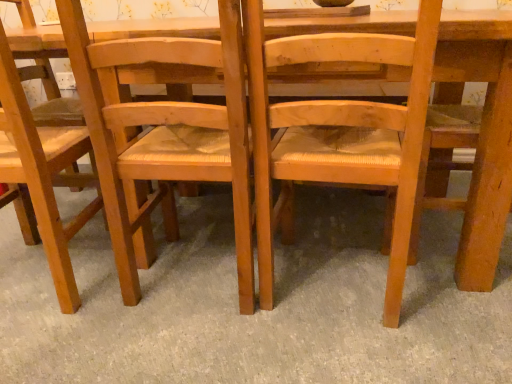
Question: Does natural wood chair at center, the third chair viewed from the left, touch light brown wood chair at left, which ranks as the 1th chair in left-to-right order?

Choices:
 (A) no
 (B) yes

Answer: (A)

Question: Can we say natural wood chair at center, the third chair viewed from the left, lies outside light brown wood chair at left, arranged as the 3th chair when viewed from the right?

Choices:
 (A) yes
 (B) no

Answer: (A)

Question: From the image's perspective, is natural wood chair at center, the third chair viewed from the left, located beneath light brown wood chair at left, arranged as the 3th chair when viewed from the right?

Choices:
 (A) no
 (B) yes

Answer: (B)

Question: Is natural wood chair at center, the third chair viewed from the left, taller than light brown wood chair at left, which ranks as the 1th chair in left-to-right order?

Choices:
 (A) yes
 (B) no

Answer: (B)

Question: Considering the relative positions of natural wood chair at center, which ranks as the first chair in right-to-left order, and light brown wood chair at left, which ranks as the 1th chair in left-to-right order, in the image provided, is natural wood chair at center, which ranks as the first chair in right-to-left order, to the right of light brown wood chair at left, which ranks as the 1th chair in left-to-right order, from the viewer's perspective?

Choices:
 (A) yes
 (B) no

Answer: (A)

Question: In terms of width, does light brown wood chair at left, arranged as the 3th chair when viewed from the right, look wider or thinner when compared to natural wood chair at center, which ranks as the first chair in right-to-left order?

Choices:
 (A) thin
 (B) wide

Answer: (B)

Question: Is light brown wood chair at left, arranged as the 3th chair when viewed from the right, situated inside natural wood chair at center, which ranks as the first chair in right-to-left order, or outside?

Choices:
 (A) inside
 (B) outside

Answer: (B)

Question: Does point click(13, 43) appear closer or farther from the camera than point click(296, 137)?

Choices:
 (A) closer
 (B) farther

Answer: (A)

Question: Relative to natural wood chair at center, the third chair viewed from the left, is light brown wood chair at left, which ranks as the 1th chair in left-to-right order, in front or behind?

Choices:
 (A) behind
 (B) front

Answer: (A)

Question: Visually, is light brown wood chair at left, arranged as the 3th chair when viewed from the right, positioned to the left or to the right of wooden woven seat at center, the 2th chair when ordered from right to left?

Choices:
 (A) right
 (B) left

Answer: (B)

Question: From a real-world perspective, is light brown wood chair at left, which ranks as the 1th chair in left-to-right order, above or below wooden woven seat at center, the 2th chair when ordered from right to left?

Choices:
 (A) above
 (B) below

Answer: (A)

Question: Relative to wooden woven seat at center, the second chair in the left-to-right sequence, is light brown wood chair at left, arranged as the 3th chair when viewed from the right, in front or behind?

Choices:
 (A) front
 (B) behind

Answer: (B)

Question: Which is correct: light brown wood chair at left, arranged as the 3th chair when viewed from the right, is inside wooden woven seat at center, the second chair in the left-to-right sequence, or outside of it?

Choices:
 (A) inside
 (B) outside

Answer: (B)

Question: Considering the positions of wooden woven seat at center, the 2th chair when ordered from right to left, and light brown wood chair at left, which ranks as the 1th chair in left-to-right order, in the image, is wooden woven seat at center, the 2th chair when ordered from right to left, wider or thinner than light brown wood chair at left, which ranks as the 1th chair in left-to-right order,?

Choices:
 (A) thin
 (B) wide

Answer: (B)

Question: In terms of height, does wooden woven seat at center, the 2th chair when ordered from right to left, look taller or shorter compared to light brown wood chair at left, arranged as the 3th chair when viewed from the right?

Choices:
 (A) tall
 (B) short

Answer: (B)